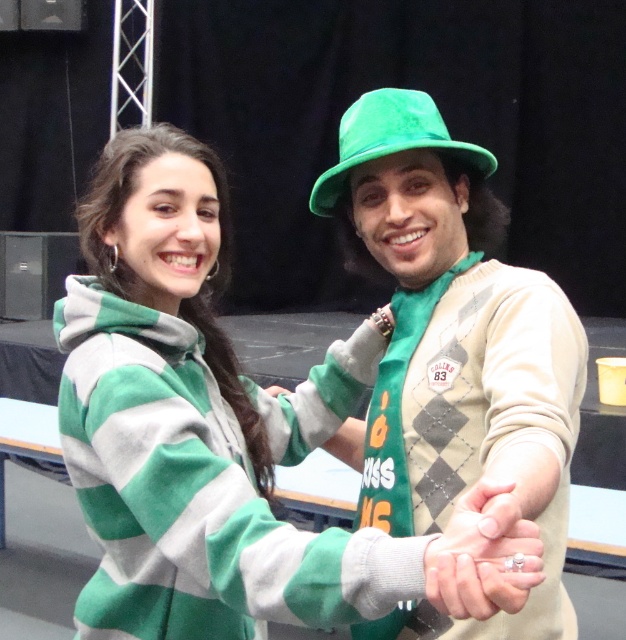
You are a photographer taking a closeup shot of the two people in the image. You need to focus on the matte gold ring at center and the velvet green hat at center. Which object should you adjust your camera to focus on first if you want to capture both in the same frame without moving the camera?

The velvet green hat at center should be focused on first because the matte gold ring at center is to the right of it, so adjusting focus starting from the hat allows capturing both in the frame without moving the camera.

In the scene shown: You are standing in front of the image and want to locate the green felt hat at upper right. What are the coordinates where you can find it?

The green felt hat at upper right can be found at coordinates point (456,364).

You are a photographer trying to capture a closeup shot of both the matte gold ring at center and the velvet green hat at center in the scene. Given that your camera lens has a maximum focus range of 25 inches, will you be able to focus on both objects simultaneously?

The matte gold ring at center and the velvet green hat at center are 30.87 inches apart from each other. Since the camera lens has a maximum focus range of 25 inches, it cannot focus on both objects at the same time because the distance between them exceeds the lens capability.